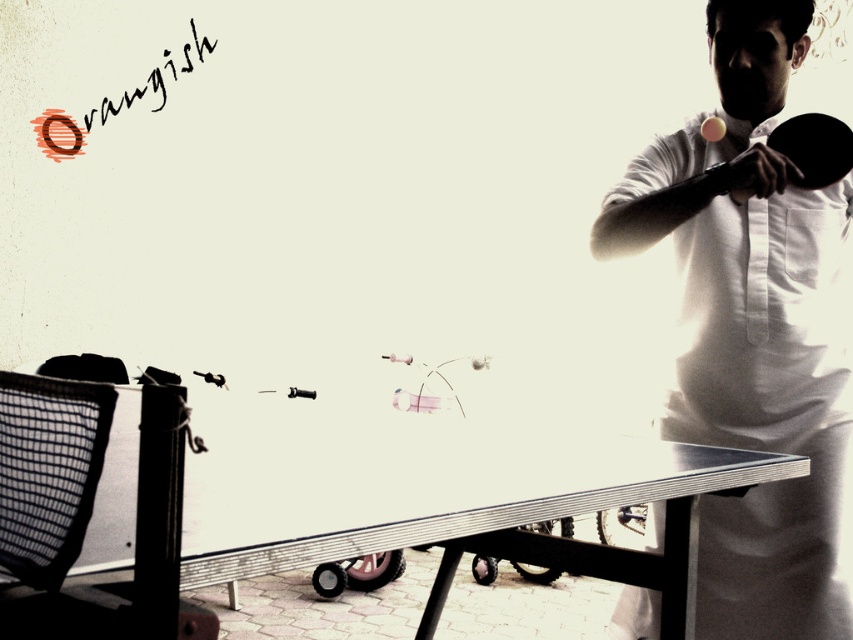
Question: Where is white matte ping pong paddle at upper right located in relation to white glossy table tennis table at center in the image?

Choices:
 (A) right
 (B) left

Answer: (A)

Question: Which of these objects is positioned closest to the white matte ping pong paddle at upper right?

Choices:
 (A) white glossy table tennis table at center
 (B) black rubber paddle at upper right

Answer: (B)

Question: Estimate the real-world distances between objects in this image. Which object is closer to the white glossy table tennis table at center?

Choices:
 (A) white matte ping pong paddle at upper right
 (B) black rubber paddle at upper right

Answer: (B)

Question: Estimate the real-world distances between objects in this image. Which object is closer to the white glossy table tennis table at center?

Choices:
 (A) black rubber paddle at upper right
 (B) white matte ping pong paddle at upper right

Answer: (A)

Question: Does white matte ping pong paddle at upper right appear on the right side of white glossy table tennis table at center?

Choices:
 (A) yes
 (B) no

Answer: (A)

Question: Is the position of white matte ping pong paddle at upper right more distant than that of white glossy table tennis table at center?

Choices:
 (A) yes
 (B) no

Answer: (B)